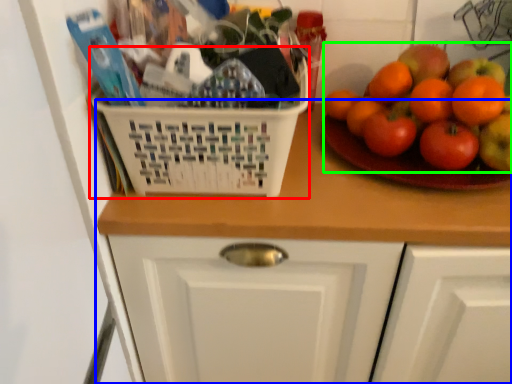
Question: Estimate the real-world distances between objects in this image. Which object is closer to basket (highlighted by a red box), counter (highlighted by a blue box) or fruit (highlighted by a green box)?

Choices:
 (A) counter
 (B) fruit

Answer: (A)